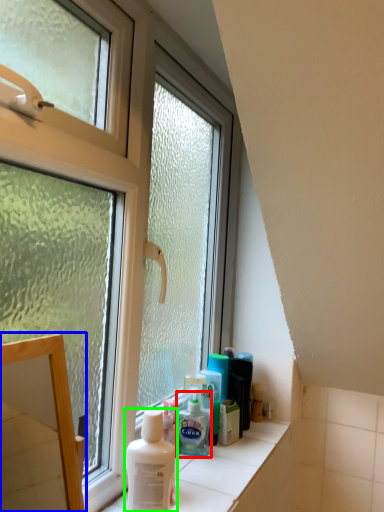
Question: Considering the real-world distances, which object is closest to shaving cream (highlighted by a red box)? mirror (highlighted by a blue box) or shaving cream (highlighted by a green box).

Choices:
 (A) mirror
 (B) shaving cream

Answer: (B)